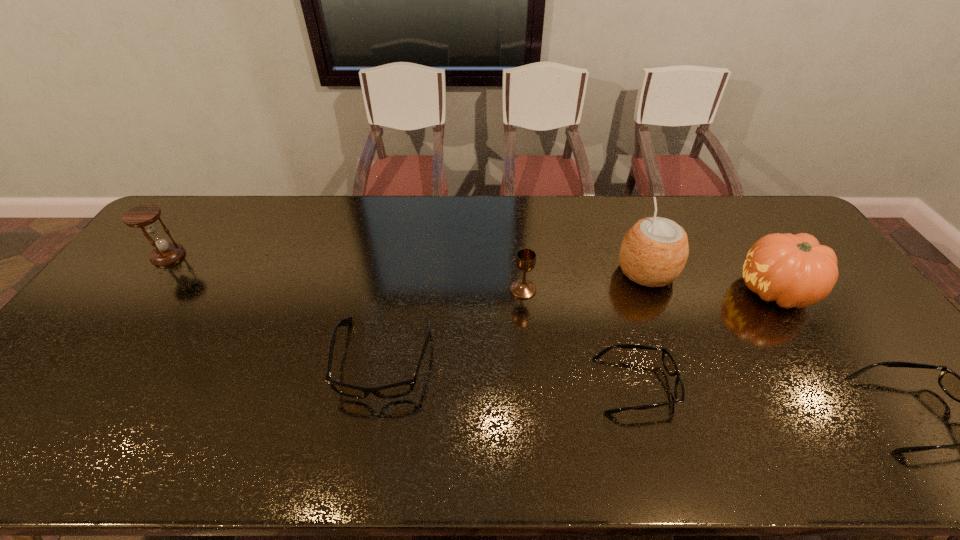
What are the coordinates of `vacant region located on the carved face of the pumpkin` in the screenshot? It's located at [x=612, y=291].

The width and height of the screenshot is (960, 540). Identify the location of free space located 0.220m on the carved face of the pumpkin. (662, 291).

Identify the location of vacant space located 0.120m on the carved face of the pumpkin. (696, 291).

Find the location of a particular element. free space located 0.070m on the right of the chalice is located at coordinates (560, 289).

Find the location of a particular element. The height and width of the screenshot is (540, 960). blank area located on the right of the coconut is located at coordinates (703, 272).

The image size is (960, 540). In order to click on object that is positioned at the left edge in this screenshot , I will do `click(144, 216)`.

Where is `object located in the right edge section of the desktop`? object located in the right edge section of the desktop is located at coordinates (795, 270).

Find the location of a particular element. The height and width of the screenshot is (540, 960). vacant area at the far edge of the desktop is located at coordinates (708, 202).

The image size is (960, 540). In the image, there is a desktop. In order to click on vacant space at the near edge in this screenshot , I will do `click(334, 397)`.

In the image, there is a desktop. Where is `vacant region at the left edge`? The width and height of the screenshot is (960, 540). vacant region at the left edge is located at coordinates (88, 357).